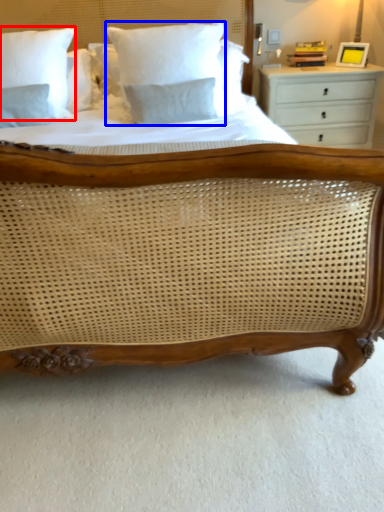
Question: Which point is further to the camera, pillow (highlighted by a red box) or pillow (highlighted by a blue box)?

Choices:
 (A) pillow
 (B) pillow

Answer: (A)